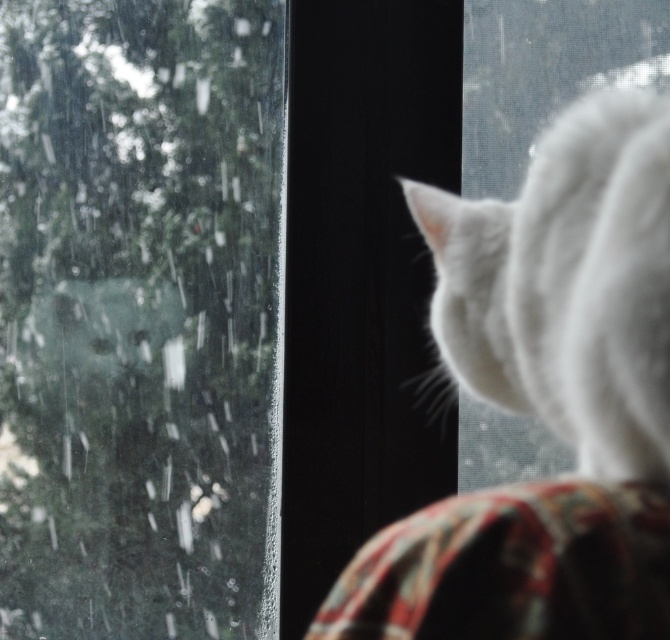
Question: Which object is farther from the camera taking this photo?

Choices:
 (A) white fluffy cat at upper right
 (B) transparent glass window at upper left

Answer: (B)

Question: Is transparent glass window at upper left wider than white fluffy cat at upper right?

Choices:
 (A) no
 (B) yes

Answer: (B)

Question: Can you confirm if transparent glass window at upper left is positioned below white fluffy cat at upper right?

Choices:
 (A) yes
 (B) no

Answer: (A)

Question: Can you confirm if transparent glass window at upper left is wider than white fluffy cat at upper right?

Choices:
 (A) no
 (B) yes

Answer: (B)

Question: Which object appears closest to the camera in this image?

Choices:
 (A) transparent glass window at upper left
 (B) white fluffy cat at upper right

Answer: (B)